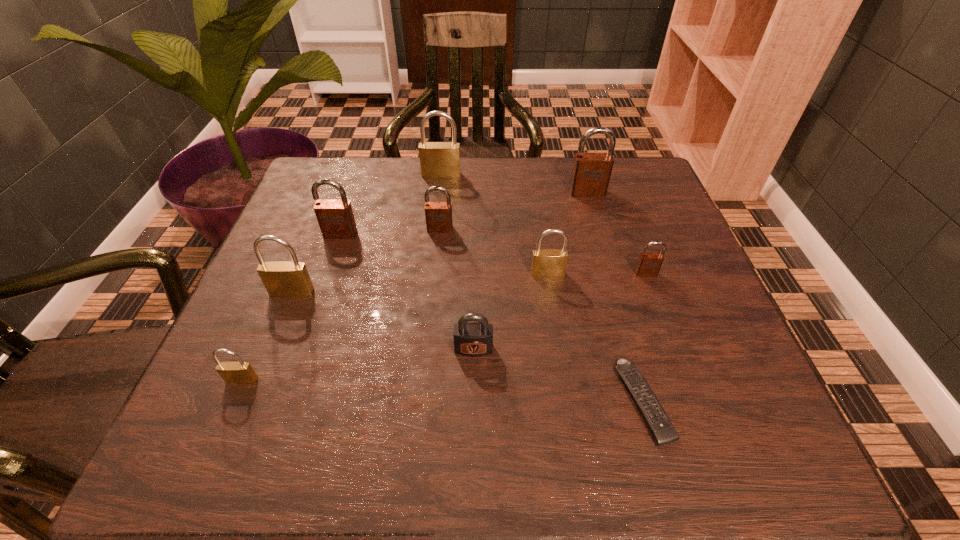
The height and width of the screenshot is (540, 960). Identify the location of the farthest object. (437, 159).

At what (x,y) coordinates should I click in order to perform the action: click on the farthest padlock. Please return your answer as a coordinate pair (x, y). This screenshot has width=960, height=540. Looking at the image, I should click on (437, 159).

Find the location of a particular element. the second farthest object is located at coordinates (591, 172).

This screenshot has width=960, height=540. I want to click on the second padlock from right to left, so 591,172.

I want to click on the fourth nearest object, so (281, 279).

The width and height of the screenshot is (960, 540). I want to click on the third farthest brass padlock, so click(281, 279).

Image resolution: width=960 pixels, height=540 pixels. Identify the location of the second biggest brown padlock. (336, 220).

At what (x,y) coordinates should I click in order to perform the action: click on the second brown padlock from left to right. Please return your answer as a coordinate pair (x, y). This screenshot has height=540, width=960. Looking at the image, I should click on (438, 215).

Locate an element on the screen. the rightmost brass padlock is located at coordinates (545, 262).

You are a GUI agent. You are given a task and a screenshot of the screen. Output one action in this format:
    pyautogui.click(x=<x>, y=<y>)
    Task: Click on the seventh padlock from left to right
    
    Given the screenshot: What is the action you would take?
    pyautogui.click(x=545, y=262)